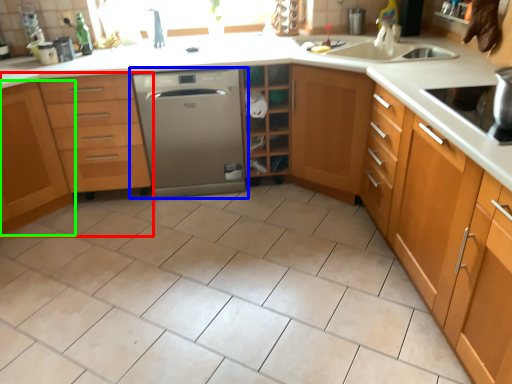
Question: Which object is positioned farthest from cabinetry (highlighted by a red box)? Select from home appliance (highlighted by a blue box) and cabinetry (highlighted by a green box).

Choices:
 (A) home appliance
 (B) cabinetry

Answer: (A)